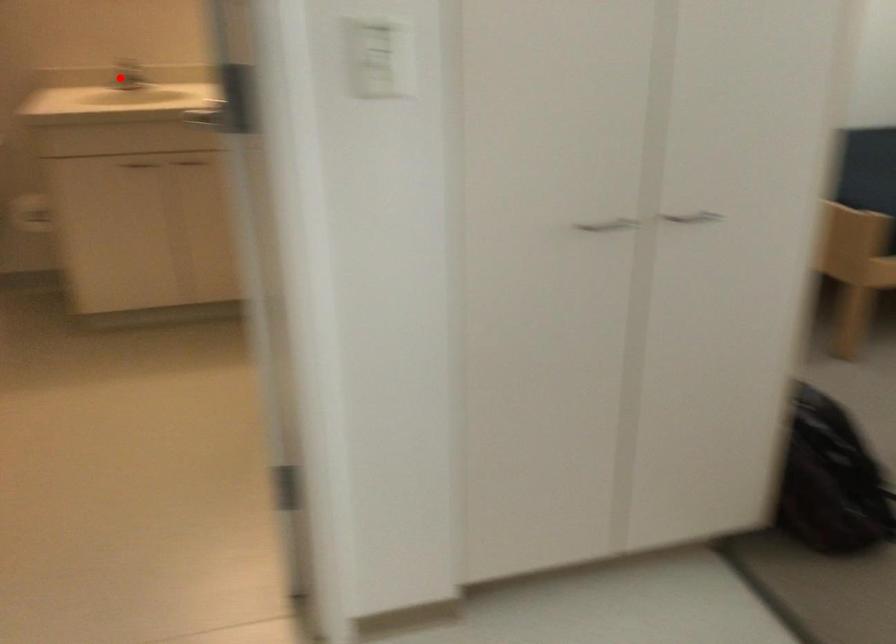
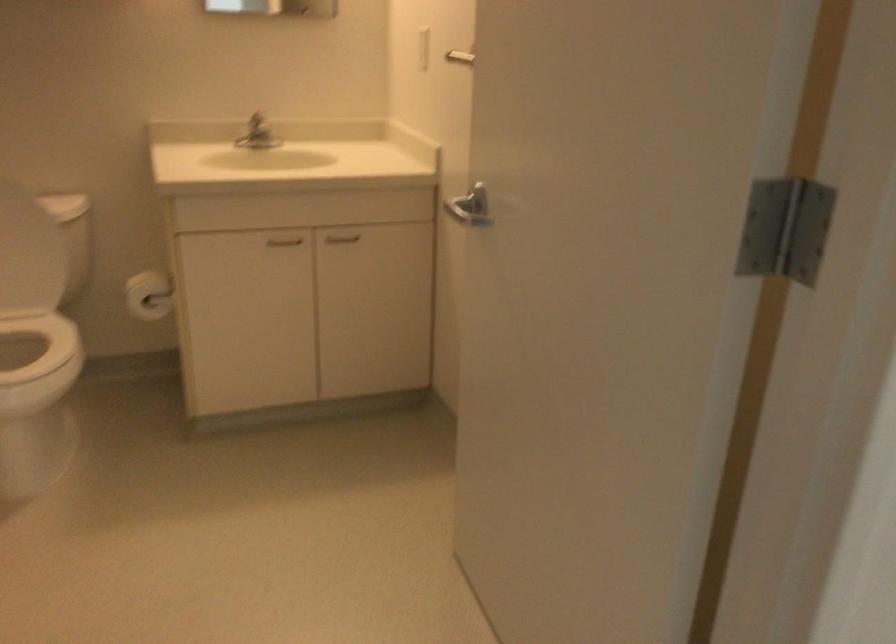
Where in the second image is the point corresponding to the highlighted location from the first image?

(255, 133)